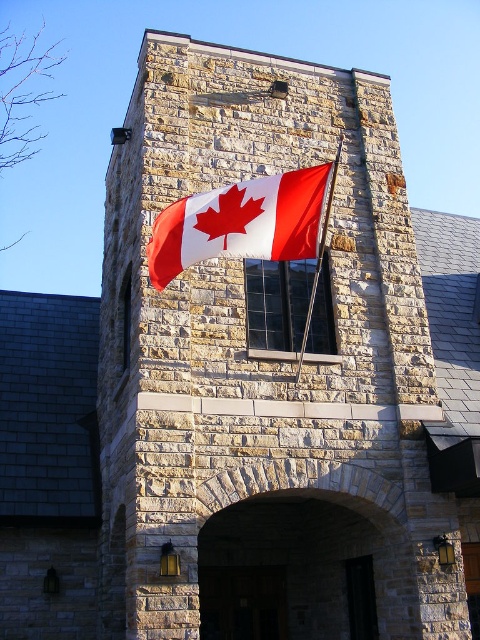
You are a visitor standing in front of the stone building. You notice the red and white fabric flag at center and the metallic flag pole at center. Which object takes up more space in the scene?

The metallic flag pole at center takes up more space in the scene than the red and white fabric flag at center because the flag occupies less space than the pole.

You are standing in front of a stone building with a Canadian flag. There is a point at coordinates [240,221]. What is this point located on?

The point at coordinates [240,221] is located on the red and white fabric flag at center.

You are a visitor approaching the stone building and notice the red and white fabric flag at center and the metallic flag pole at center. Which object is closer to you as you face the building?

The red and white fabric flag at center is closer to you because the metallic flag pole at center is behind it.